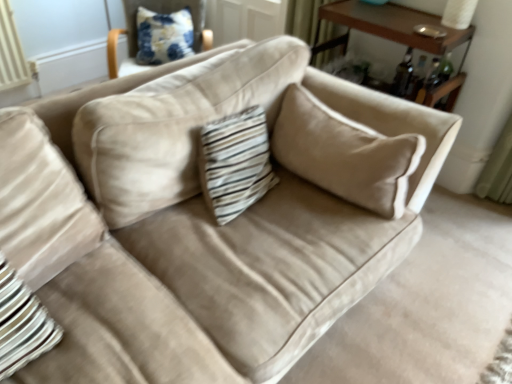
The image size is (512, 384). Describe the element at coordinates (397, 36) in the screenshot. I see `brown wood table at upper right` at that location.

In order to click on white paper lampshade at upper right in this screenshot , I will do `click(458, 13)`.

The width and height of the screenshot is (512, 384). Find the location of `pillow that is above the brown wood table at upper right (from the image's perspective)`. pillow that is above the brown wood table at upper right (from the image's perspective) is located at coordinates (164, 36).

Considering the sizes of blue printed fabric pillow at upper left and brown wood table at upper right in the image, is blue printed fabric pillow at upper left wider or thinner than brown wood table at upper right?

Clearly, blue printed fabric pillow at upper left has less width compared to brown wood table at upper right.

Is blue printed fabric pillow at upper left facing away from brown wood table at upper right?

No, blue printed fabric pillow at upper left's orientation is not away from brown wood table at upper right.

Considering the points (355, 20) and (449, 8), which point is behind, point (355, 20) or point (449, 8)?

The point (355, 20) is behind.

Is white paper lampshade at upper right inside brown wood table at upper right?

Actually, white paper lampshade at upper right is outside brown wood table at upper right.

From the image's perspective, is brown wood table at upper right over white paper lampshade at upper right?

Incorrect, from the image's perspective, brown wood table at upper right is lower than white paper lampshade at upper right.

From a real-world perspective, which is physically below, brown wood table at upper right or white paper lampshade at upper right?

brown wood table at upper right is physically lower.

How different are the orientations of brown wood table at upper right and blue printed fabric pillow at upper left in degrees?

51.4 degrees.

Is brown wood table at upper right taller or shorter than blue printed fabric pillow at upper left?

Clearly, brown wood table at upper right is taller compared to blue printed fabric pillow at upper left.

Who is bigger, brown wood table at upper right or blue printed fabric pillow at upper left?

Bigger between the two is brown wood table at upper right.

Based on the photo, considering the relative sizes of blue printed fabric pillow at upper left and white paper lampshade at upper right in the image provided, is blue printed fabric pillow at upper left smaller than white paper lampshade at upper right?

No, blue printed fabric pillow at upper left is not smaller than white paper lampshade at upper right.

Is blue printed fabric pillow at upper left to the left of white paper lampshade at upper right from the viewer's perspective?

Correct, you'll find blue printed fabric pillow at upper left to the left of white paper lampshade at upper right.

Between point (149, 13) and point (448, 18), which one is positioned behind?

The point (149, 13) is more distant.

Where is `pillow behind the white paper lampshade at upper right`? pillow behind the white paper lampshade at upper right is located at coordinates (164, 36).

Considering the sizes of white paper lampshade at upper right and brown wood table at upper right in the image, is white paper lampshade at upper right taller or shorter than brown wood table at upper right?

white paper lampshade at upper right is shorter than brown wood table at upper right.

Does white paper lampshade at upper right lie behind brown wood table at upper right?

Yes.

Which is in front, point (456, 12) or point (426, 40)?

Positioned in front is point (426, 40).

Is white paper lampshade at upper right directly adjacent to blue printed fabric pillow at upper left?

white paper lampshade at upper right and blue printed fabric pillow at upper left are clearly separated.

Is white paper lampshade at upper right at the right side of blue printed fabric pillow at upper left?

Indeed, white paper lampshade at upper right is positioned on the right side of blue printed fabric pillow at upper left.

From a real-world perspective, between white paper lampshade at upper right and blue printed fabric pillow at upper left, who is vertically lower?

From a 3D spatial view, blue printed fabric pillow at upper left is below.

This screenshot has width=512, height=384. Identify the location of pillow located behind the brown wood table at upper right. (164, 36).

Image resolution: width=512 pixels, height=384 pixels. There is a brown wood table at upper right. In order to click on table lamp above it (from a real-world perspective) in this screenshot , I will do `click(458, 13)`.

Estimate the real-world distances between objects in this image. Which object is further from blue printed fabric pillow at upper left, brown wood table at upper right or white paper lampshade at upper right?

white paper lampshade at upper right is positioned further to the anchor blue printed fabric pillow at upper left.

Estimate the real-world distances between objects in this image. Which object is closer to blue printed fabric pillow at upper left, white paper lampshade at upper right or brown wood table at upper right?

brown wood table at upper right is positioned closer to the anchor blue printed fabric pillow at upper left.

Which object lies nearer to the anchor point brown wood table at upper right, white paper lampshade at upper right or blue printed fabric pillow at upper left?

white paper lampshade at upper right is closer to brown wood table at upper right.

Which object lies nearer to the anchor point white paper lampshade at upper right, brown wood table at upper right or blue printed fabric pillow at upper left?

The object closer to white paper lampshade at upper right is brown wood table at upper right.

Estimate the real-world distances between objects in this image. Which object is further from brown wood table at upper right, blue printed fabric pillow at upper left or white paper lampshade at upper right?

blue printed fabric pillow at upper left.

Estimate the real-world distances between objects in this image. Which object is closer to white paper lampshade at upper right, blue printed fabric pillow at upper left or brown wood table at upper right?

Among the two, brown wood table at upper right is located nearer to white paper lampshade at upper right.

Identify the location of table between blue printed fabric pillow at upper left and white paper lampshade at upper right. The height and width of the screenshot is (384, 512). (397, 36).